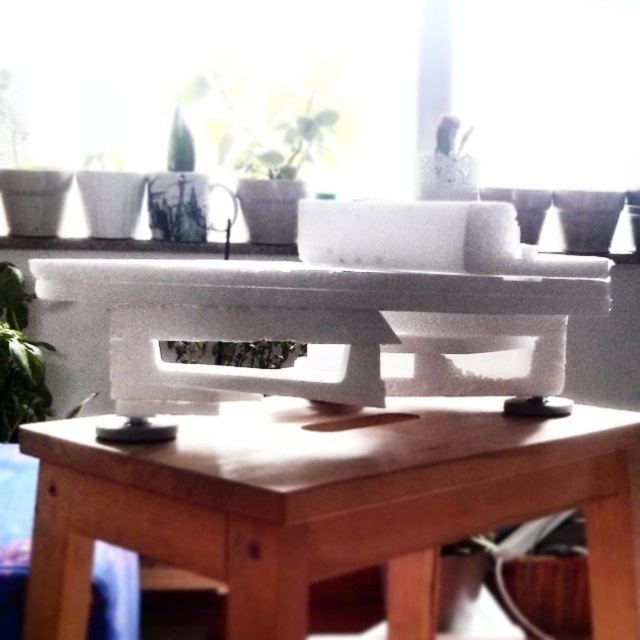
Between transparent glass window at upper center and green matte plant at lower left, which one has less height?

With less height is green matte plant at lower left.

Who is positioned more to the left, transparent glass window at upper center or green matte plant at lower left?

From the viewer's perspective, green matte plant at lower left appears more on the left side.

Is point (630, 164) less distant than point (52, 346)?

No, it is behind (52, 346).

The height and width of the screenshot is (640, 640). What are the coordinates of `transparent glass window at upper center` in the screenshot? It's located at (548, 90).

In the scene shown: Does brown wooden table at center have a larger size compared to green matte plant at lower left?

Indeed, brown wooden table at center has a larger size compared to green matte plant at lower left.

Can you confirm if brown wooden table at center is wider than green matte plant at lower left?

Yes, brown wooden table at center is wider than green matte plant at lower left.

This screenshot has height=640, width=640. Describe the element at coordinates (330, 502) in the screenshot. I see `brown wooden table at center` at that location.

Locate an element on the screen. This screenshot has width=640, height=640. brown wooden table at center is located at coordinates (330, 502).

Who is more forward, [460,68] or [246,150]?

Point [246,150]

Measure the distance between transparent glass window at upper center and green matte plant at upper center.

transparent glass window at upper center and green matte plant at upper center are 67.15 centimeters apart.

Locate an element on the screen. The width and height of the screenshot is (640, 640). transparent glass window at upper center is located at coordinates click(x=548, y=90).